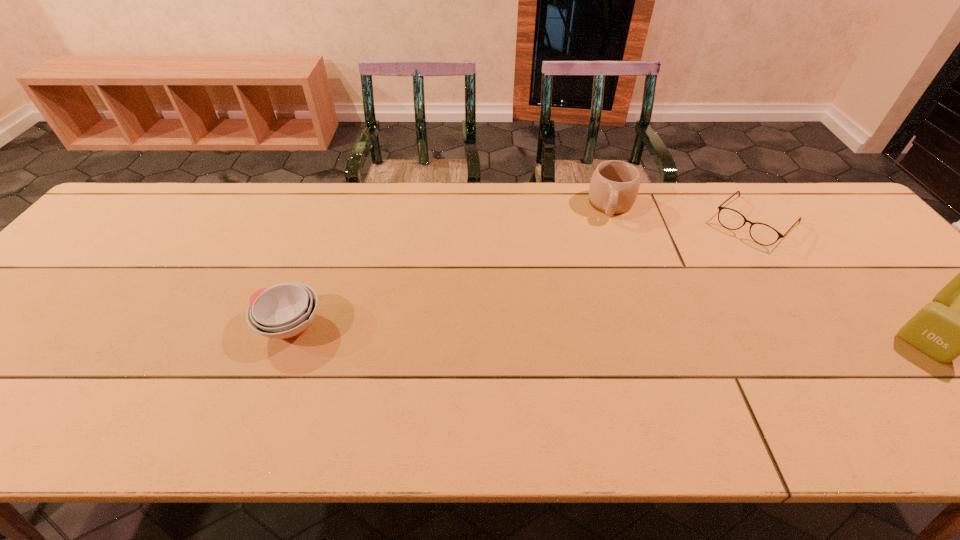
This screenshot has height=540, width=960. Identify the location of free location located 0.360m on the front-facing side of the shortest object. (667, 310).

You are a GUI agent. You are given a task and a screenshot of the screen. Output one action in this format:
    pyautogui.click(x=<x>, y=<y>)
    Task: Click on the mug located in the far edge section of the desktop
    
    Given the screenshot: What is the action you would take?
    pyautogui.click(x=614, y=186)

This screenshot has width=960, height=540. I want to click on spectacles that is at the far edge, so click(763, 234).

This screenshot has height=540, width=960. I want to click on object present at the right edge, so click(763, 234).

Locate an element on the screen. object present at the far right corner is located at coordinates (763, 234).

In the image, there is a desktop. Where is `vacant space at the far edge`? The image size is (960, 540). vacant space at the far edge is located at coordinates (560, 186).

Where is `vacant area at the near edge of the desktop`? vacant area at the near edge of the desktop is located at coordinates (484, 365).

The height and width of the screenshot is (540, 960). What are the coordinates of `vacant region at the right edge` in the screenshot? It's located at (895, 267).

This screenshot has width=960, height=540. What are the coordinates of `vacant space at the far left corner of the desktop` in the screenshot? It's located at (180, 188).

This screenshot has height=540, width=960. In order to click on blank area at the near right corner in this screenshot , I will do point(942,375).